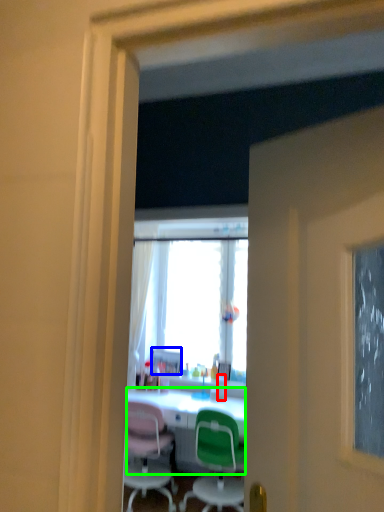
Question: Estimate the real-world distances between objects in this image. Which object is farther from bottle (highlighted by a red box), picture frame (highlighted by a blue box) or desk (highlighted by a green box)?

Choices:
 (A) picture frame
 (B) desk

Answer: (A)